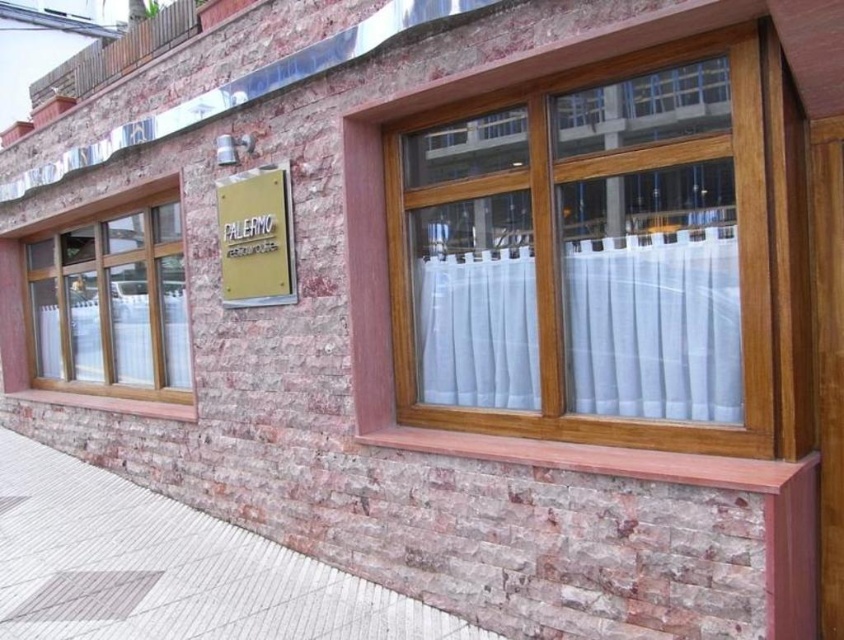
You are standing at the entrance of the building and want to compare the height of the wooden frame at upper center and the white concrete pavement at lower left. Which one is taller?

The wooden frame at upper center is taller than the white concrete pavement at lower left according to the description.

You are standing at the point marked as point (169, 566) in the image. What material are you standing on?

You are standing on white concrete pavement at lower left.